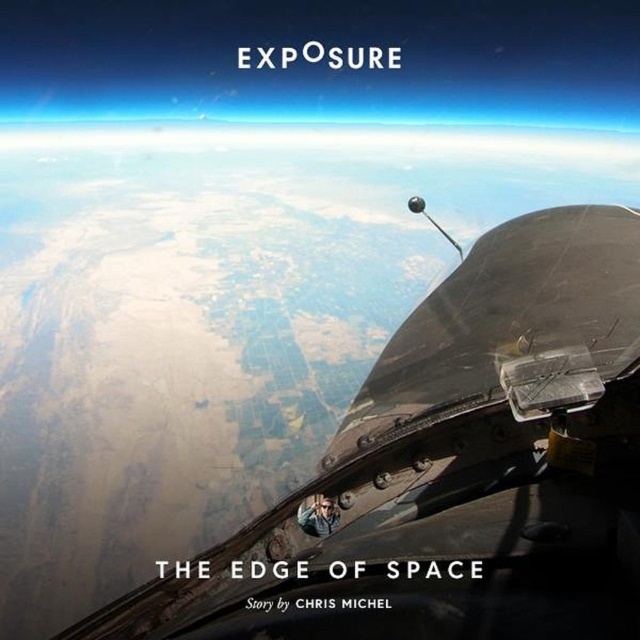
Is point (467, 364) positioned behind point (332, 508)?

Yes, point (467, 364) is behind point (332, 508).

Which of these two, shiny metallic cockpit at center or matte black helmet at center, stands shorter?

Standing shorter between the two is matte black helmet at center.

Is point (557, 540) positioned in front of point (298, 518)?

Yes, point (557, 540) is in front of point (298, 518).

Image resolution: width=640 pixels, height=640 pixels. In order to click on shiny metallic cockpit at center in this screenshot , I will do `click(456, 468)`.